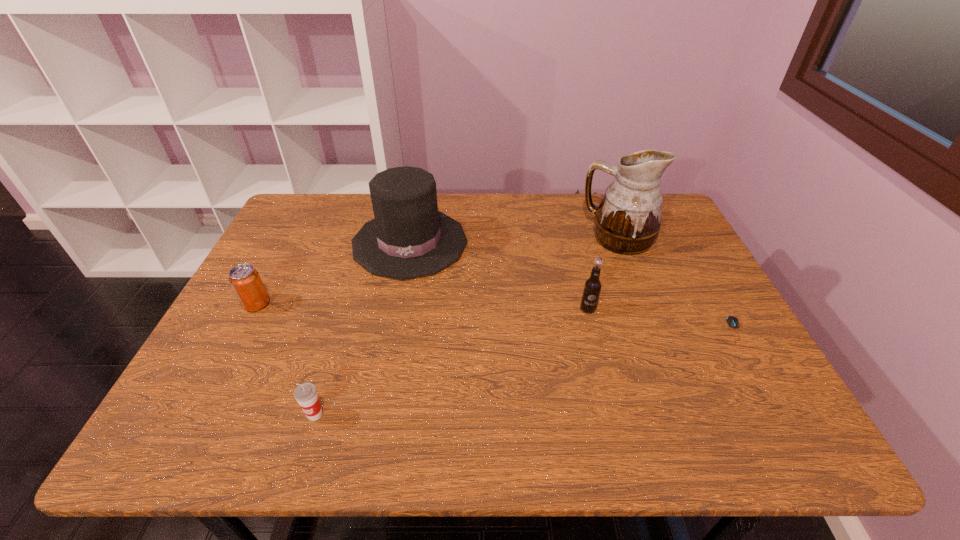
Select which object appears as the third closest to the second nearest object. Please provide its 2D coordinates. Your answer should be formatted as a tuple, i.e. [(x, y)], where the tuple contains the x and y coordinates of a point satisfying the conditions above.

[(408, 238)]

The width and height of the screenshot is (960, 540). I want to click on free spot that satisfies the following two spatial constraints: 1. from the spout of the fifth object from left to right; 2. on the label of the root beer, so click(645, 309).

At what (x,y) coordinates should I click in order to perform the action: click on vacant area that satisfies the following two spatial constraints: 1. from the spout of the second object from right to left; 2. on the left side of the mouse. Please return your answer as a coordinate pair (x, y). Image resolution: width=960 pixels, height=540 pixels. Looking at the image, I should click on (654, 330).

This screenshot has height=540, width=960. I want to click on vacant space that satisfies the following two spatial constraints: 1. on the front of the shortest object with the decoration; 2. on the right side of the second tallest object, so click(393, 330).